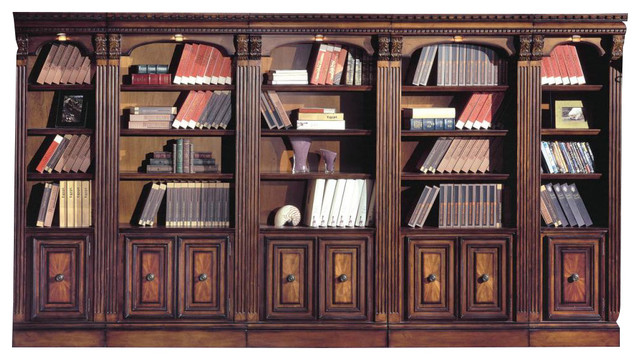
The image size is (640, 360). Identify the location of 2nd shelf. (60, 171), (147, 178), (301, 171), (438, 171), (556, 171).